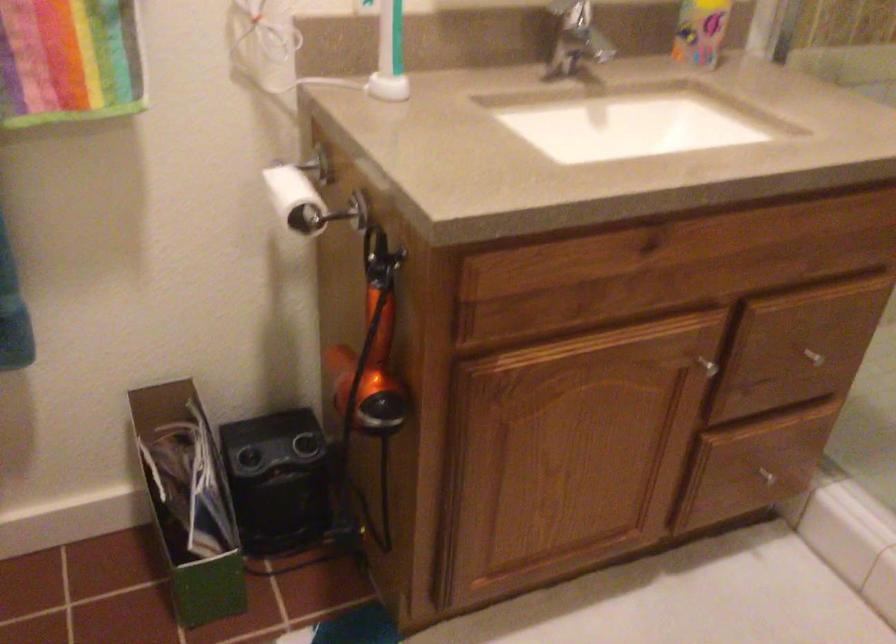
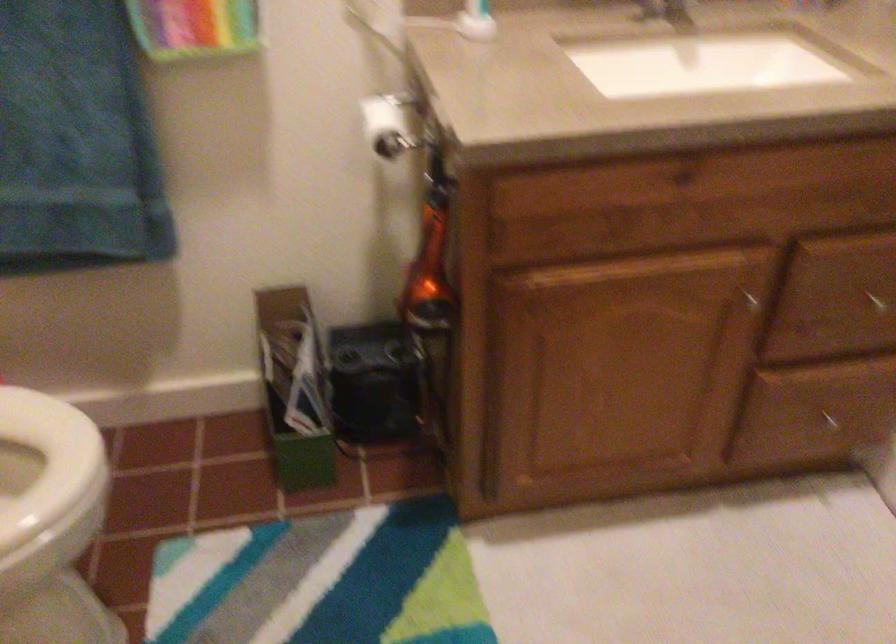
The point at (x=373, y=359) is marked in the first image. Where is the corresponding point in the second image?

(429, 267)